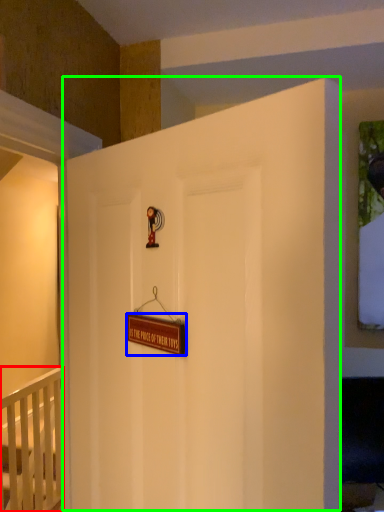
Question: Which object is positioned farthest from infant bed (highlighted by a red box)? Select from plaque (highlighted by a blue box) and door (highlighted by a green box).

Choices:
 (A) plaque
 (B) door

Answer: (A)